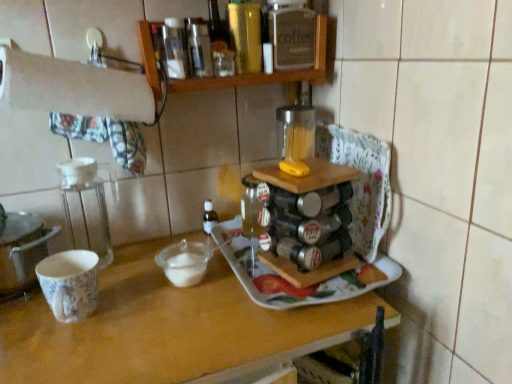
The image size is (512, 384). I want to click on vacant space in between transparent glass mixing bowl at center and transparent plastic container at left, so click(133, 273).